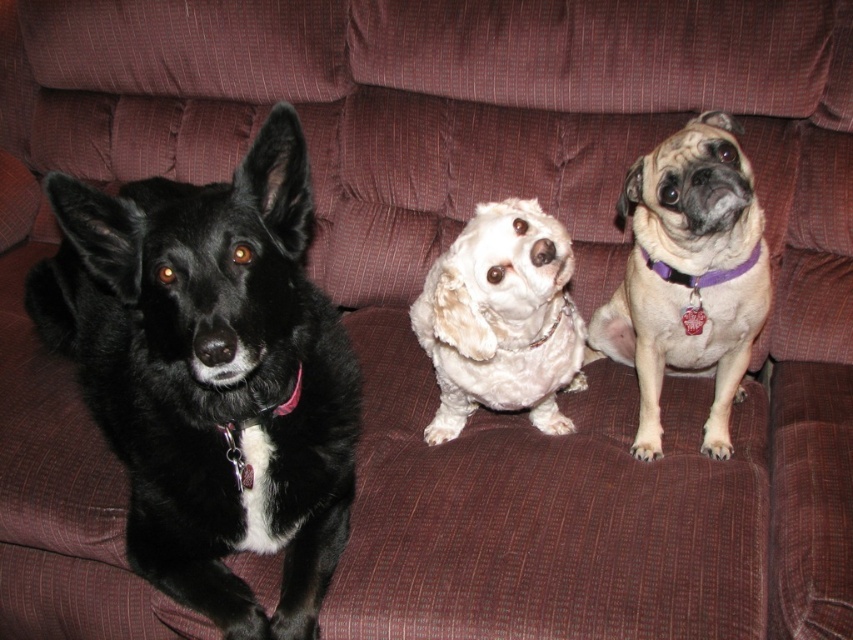
Between black furry dog at left and white fluffy dog at center, which one has less height?

With less height is white fluffy dog at center.

Looking at this image, is the position of black furry dog at left more distant than that of white fluffy dog at center?

No, black furry dog at left is closer to the viewer.

Is point (271, 484) farther from camera compared to point (549, 257)?

Yes, point (271, 484) is farther from viewer.

Locate an element on the screen. black furry dog at left is located at coordinates (212, 376).

Does black furry dog at left have a greater height compared to pale beige fur at center?

Indeed, black furry dog at left has a greater height compared to pale beige fur at center.

Can you confirm if black furry dog at left is positioned above pale beige fur at center?

No.

What do you see at coordinates (212, 376) in the screenshot?
I see `black furry dog at left` at bounding box center [212, 376].

Find the location of `black furry dog at left`. black furry dog at left is located at coordinates (212, 376).

Is pale beige fur at center smaller than white fluffy dog at center?

No, pale beige fur at center is not smaller than white fluffy dog at center.

Is point (698, 348) closer to camera compared to point (503, 332)?

No, it is not.

The image size is (853, 640). I want to click on pale beige fur at center, so click(688, 276).